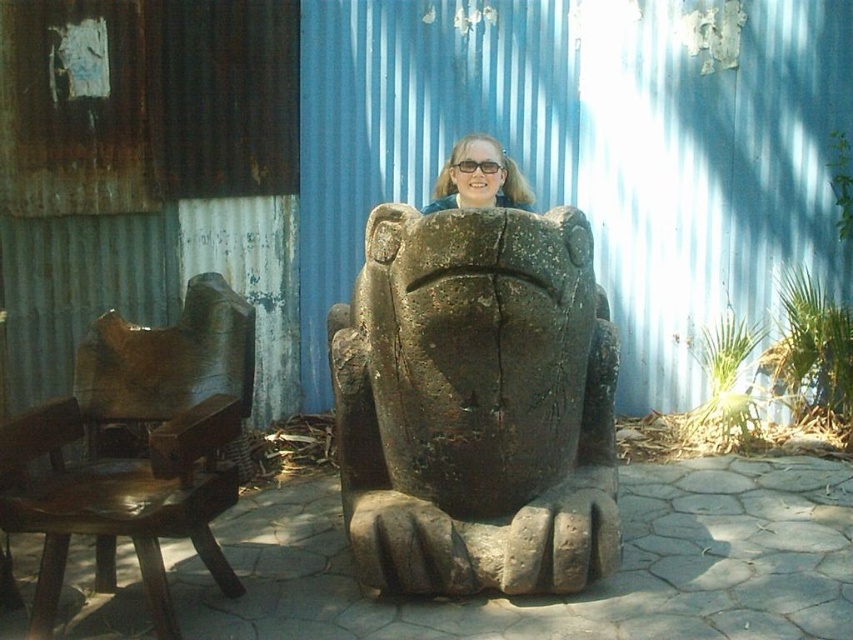
Question: Considering the relative positions of dark brown stone statue at center and matte brown stone statue at center in the image provided, where is dark brown stone statue at center located with respect to matte brown stone statue at center?

Choices:
 (A) below
 (B) above

Answer: (A)

Question: Which of the following is the closest to the observer?

Choices:
 (A) brown polished wood chair at left
 (B) dark brown stone statue at center
 (C) matte brown stone statue at center

Answer: (A)

Question: Estimate the real-world distances between objects in this image. Which object is farther from the brown polished wood chair at left?

Choices:
 (A) dark brown stone statue at center
 (B) matte brown stone statue at center

Answer: (B)

Question: Which object is closer to the camera taking this photo?

Choices:
 (A) matte brown stone statue at center
 (B) dark brown stone statue at center

Answer: (B)

Question: Does dark brown stone statue at center appear over brown polished wood chair at left?

Choices:
 (A) no
 (B) yes

Answer: (B)

Question: Observing the image, what is the correct spatial positioning of dark brown stone statue at center in reference to brown polished wood chair at left?

Choices:
 (A) left
 (B) right

Answer: (B)